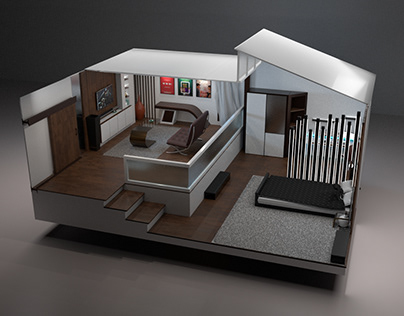
Find the location of a particular element. pillows on the bed is located at coordinates (347, 184), (349, 196).